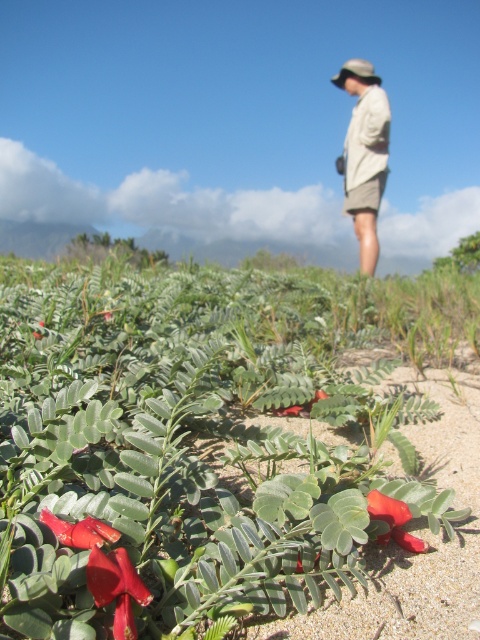
Question: Which object is closer to the camera taking this photo?

Choices:
 (A) white fabric hat at upper center
 (B) green matte leaves at lower left
 (C) bright red matte flower at center

Answer: (B)

Question: Estimate the real-world distances between objects in this image. Which object is farther from the beige fabric shirt at upper right?

Choices:
 (A) smooth red flower at center
 (B) white fabric hat at upper center

Answer: (A)

Question: Which of the following is the closest to the observer?

Choices:
 (A) (29, 276)
 (B) (88, 518)
 (C) (335, 81)
 (D) (355, 134)

Answer: (B)

Question: Can you confirm if green matte leaves at lower left is smaller than beige fabric shirt at upper right?

Choices:
 (A) yes
 (B) no

Answer: (B)

Question: Observing the image, what is the correct spatial positioning of beige fabric shirt at upper right in reference to white fabric hat at upper center?

Choices:
 (A) right
 (B) left

Answer: (B)

Question: Can you confirm if smooth red flower at lower left is positioned to the right of smooth red flower at center?

Choices:
 (A) no
 (B) yes

Answer: (A)